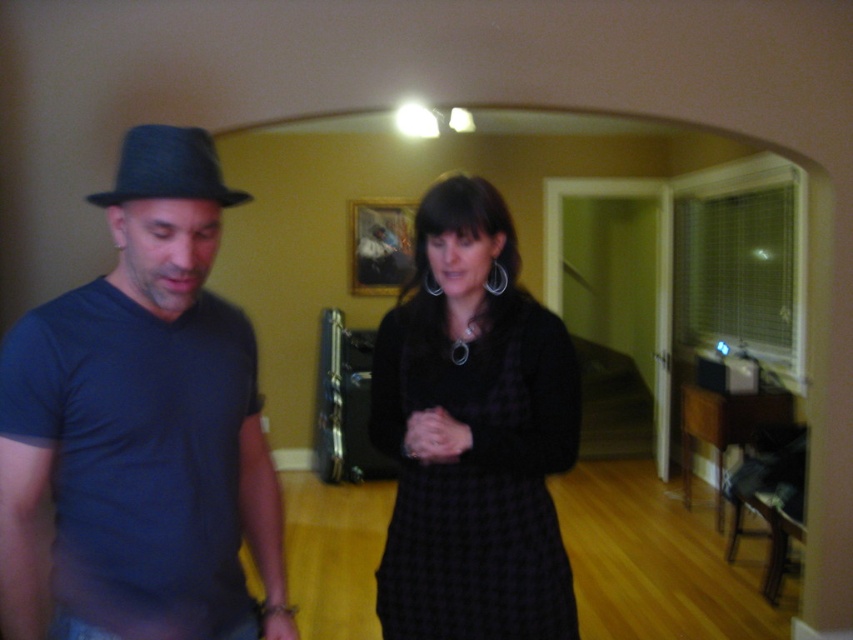
Is black textured dress at center to the right of black felt fedora at left from the viewer's perspective?

Correct, you'll find black textured dress at center to the right of black felt fedora at left.

Who is more distant from viewer, (x=538, y=499) or (x=218, y=168)?

Positioned behind is point (x=538, y=499).

The height and width of the screenshot is (640, 853). Identify the location of black textured dress at center. (473, 433).

Can you confirm if dark blue t-shirt at left is smaller than black textured dress at center?

No, dark blue t-shirt at left is not smaller than black textured dress at center.

From the picture: Which of these two, dark blue t-shirt at left or black textured dress at center, stands shorter?

With less height is dark blue t-shirt at left.

Measure the distance between point (256, 456) and camera.

1.44 meters

At what (x,y) coordinates should I click in order to perform the action: click on dark blue t-shirt at left. Please return your answer as a coordinate pair (x, y). Image resolution: width=853 pixels, height=640 pixels. Looking at the image, I should click on (141, 428).

Who is more forward, (120, 262) or (154, 177)?

Point (154, 177)

Is dark blue t-shirt at left positioned behind black felt fedora at left?

No, it is not.

At what (x,y) coordinates should I click in order to perform the action: click on dark blue t-shirt at left. Please return your answer as a coordinate pair (x, y). The width and height of the screenshot is (853, 640). Looking at the image, I should click on (141, 428).